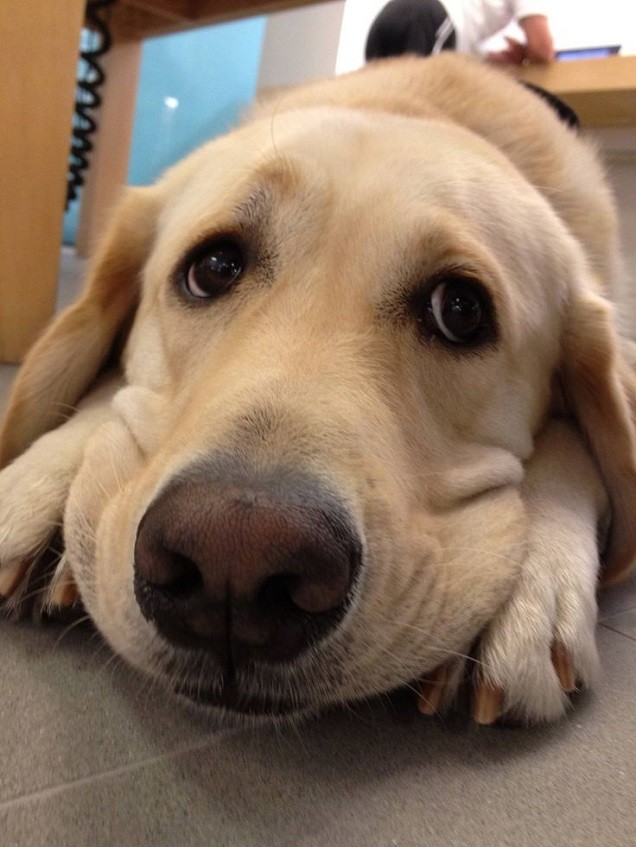
In order to click on computer screen in this screenshot , I will do `click(570, 53)`.